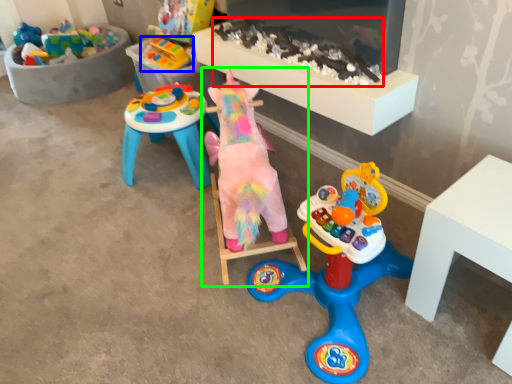
Question: Estimate the real-world distances between objects in this image. Which object is farther from toy (highlighted by a red box), toy (highlighted by a blue box) or toy (highlighted by a green box)?

Choices:
 (A) toy
 (B) toy

Answer: (A)